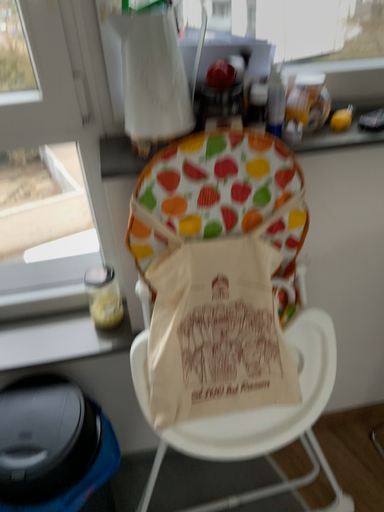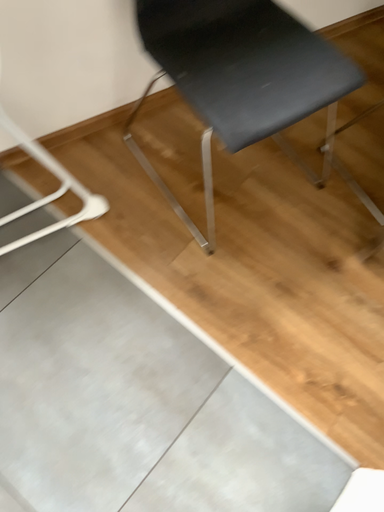
Question: How did the camera likely rotate when shooting the video?

Choices:
 (A) rotated upward
 (B) rotated downward

Answer: (B)